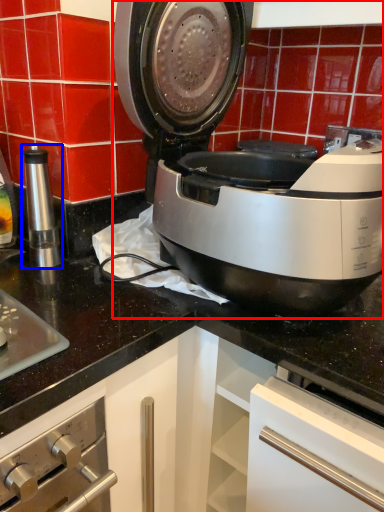
Question: Which object is closer to the camera taking this photo, home appliance (highlighted by a red box) or kitchen appliance (highlighted by a blue box)?

Choices:
 (A) home appliance
 (B) kitchen appliance

Answer: (A)